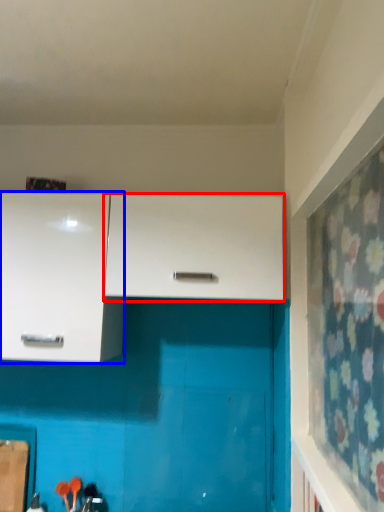
Question: Which object appears farthest to the camera in this image, cabinetry (highlighted by a red box) or cabinetry (highlighted by a blue box)?

Choices:
 (A) cabinetry
 (B) cabinetry

Answer: (B)